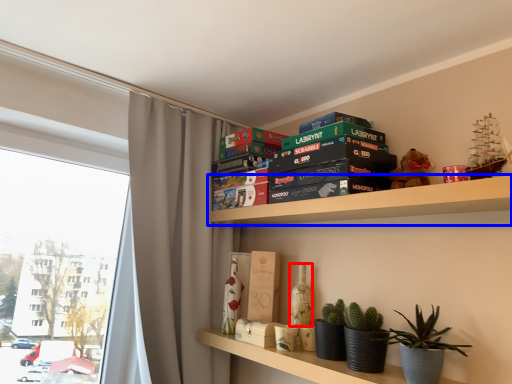
Question: Which object is further to the camera taking this photo, bottle (highlighted by a red box) or shelf (highlighted by a blue box)?

Choices:
 (A) bottle
 (B) shelf

Answer: (A)